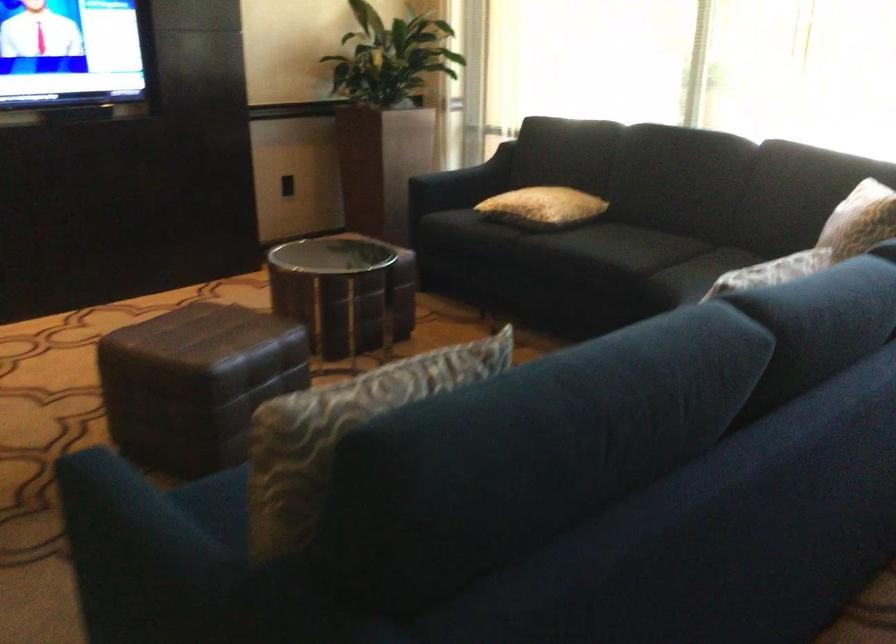
This screenshot has height=644, width=896. Describe the element at coordinates (626, 254) in the screenshot. I see `a sofa sitting surface` at that location.